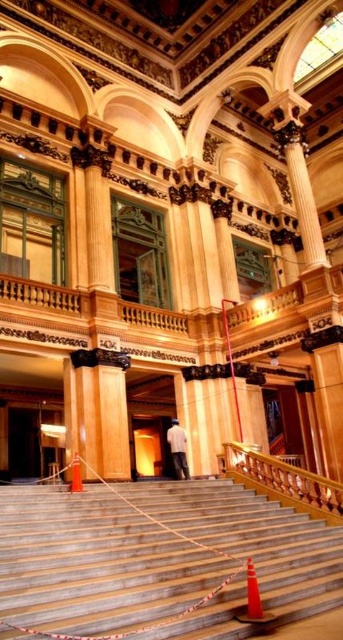
Question: Does wooden staircase at center have a lesser width compared to white matte shirt at center?

Choices:
 (A) yes
 (B) no

Answer: (B)

Question: Is white matte shirt at center behind orange cone at center?

Choices:
 (A) no
 (B) yes

Answer: (B)

Question: Considering the real-world distances, which object is farthest from the orange cone at center?

Choices:
 (A) wooden staircase at center
 (B) orange traffic cone at lower center
 (C) white matte shirt at center

Answer: (B)

Question: Which point appears farthest from the camera in this image?

Choices:
 (A) (308, 520)
 (B) (173, 444)

Answer: (B)

Question: Which is nearer to the wooden at center?

Choices:
 (A) wooden staircase at center
 (B) white matte shirt at center

Answer: (A)

Question: Is orange traffic cone at lower center to the right of white matte shirt at center from the viewer's perspective?

Choices:
 (A) no
 (B) yes

Answer: (B)